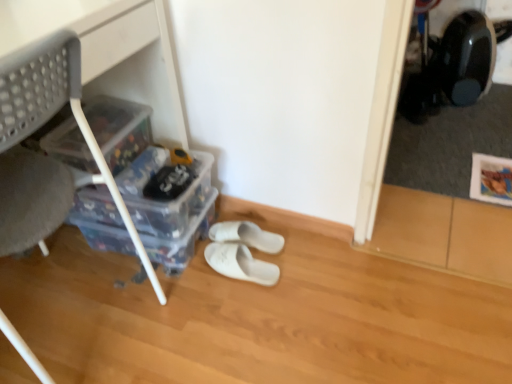
I want to click on spots to the right of white fabric slippers at center, marked as the 2th footwear in a back-to-front arrangement, so click(x=305, y=269).